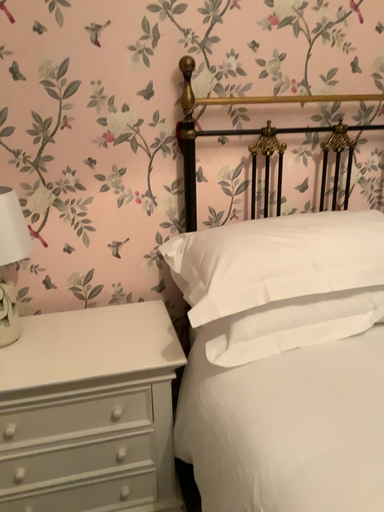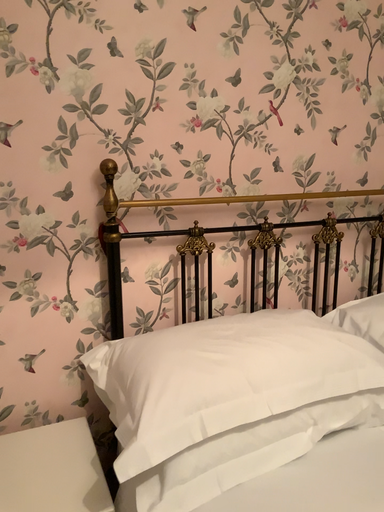
Question: Which way did the camera rotate in the video?

Choices:
 (A) rotated right
 (B) rotated left

Answer: (A)